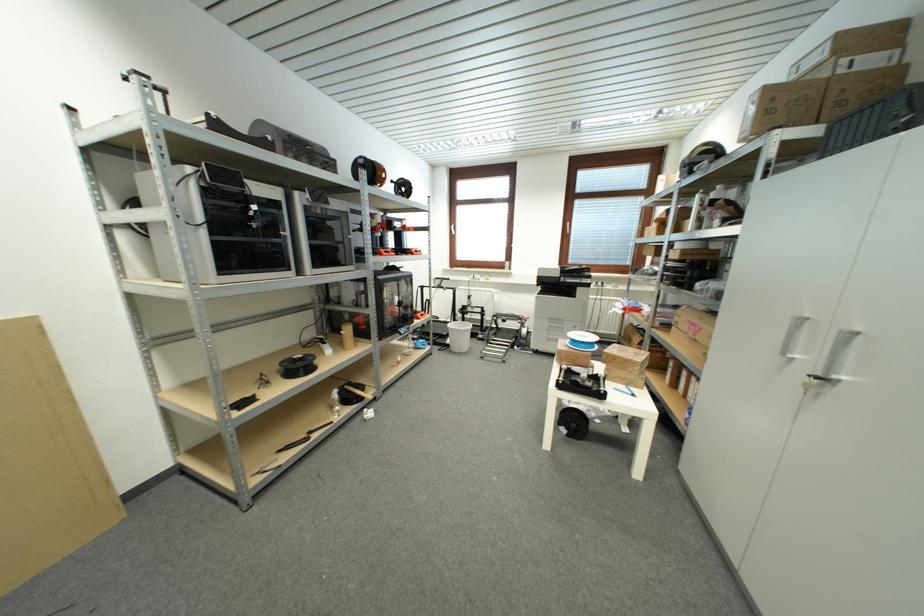
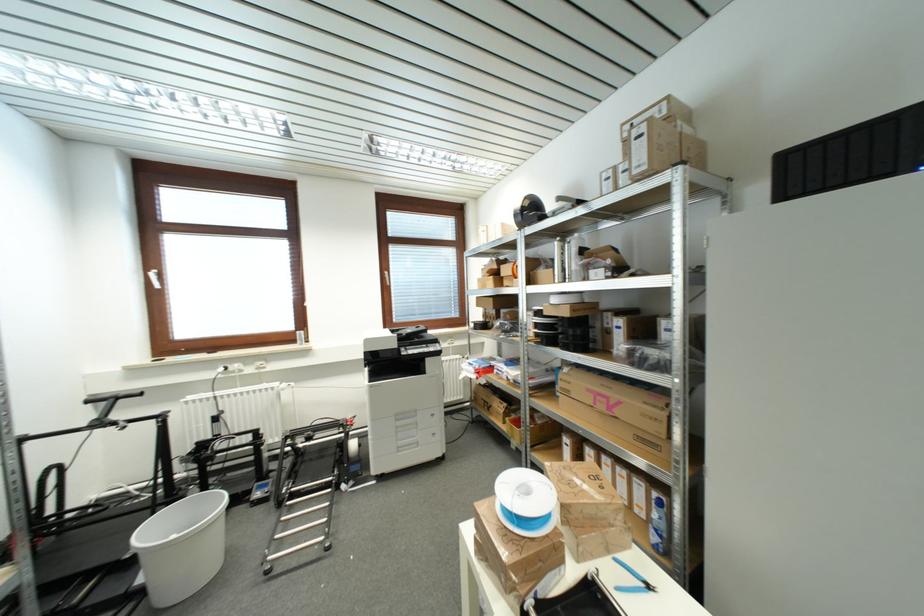
Find the pixel in the second image that matches (x=638, y=398) in the first image.

(652, 590)